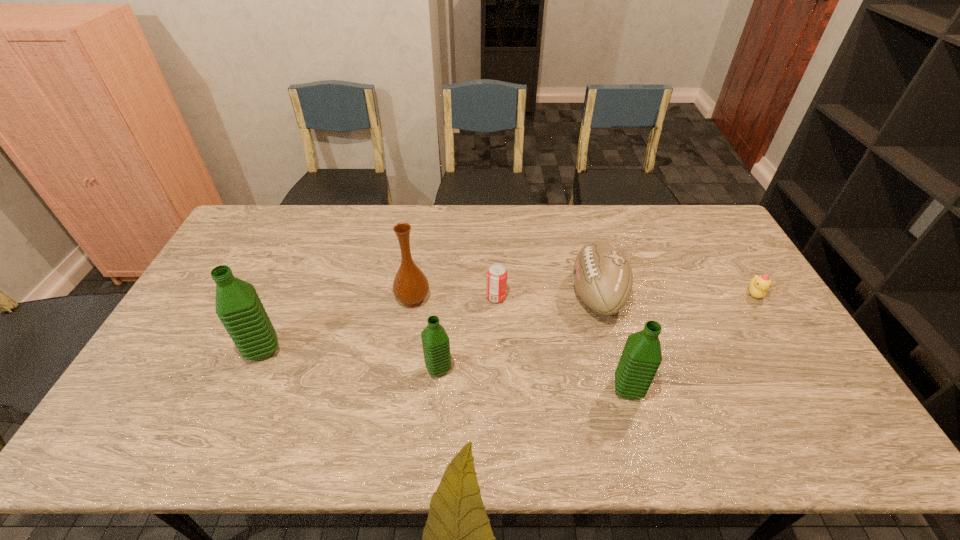
Please show where to add a water bottle on the right while keeping spacing even. Please provide its 2D coordinates. Your answer should be formatted as a tuple, i.e. [(x, y)], where the tuple contains the x and y coordinates of a point satisfying the conditions above.

[(832, 411)]